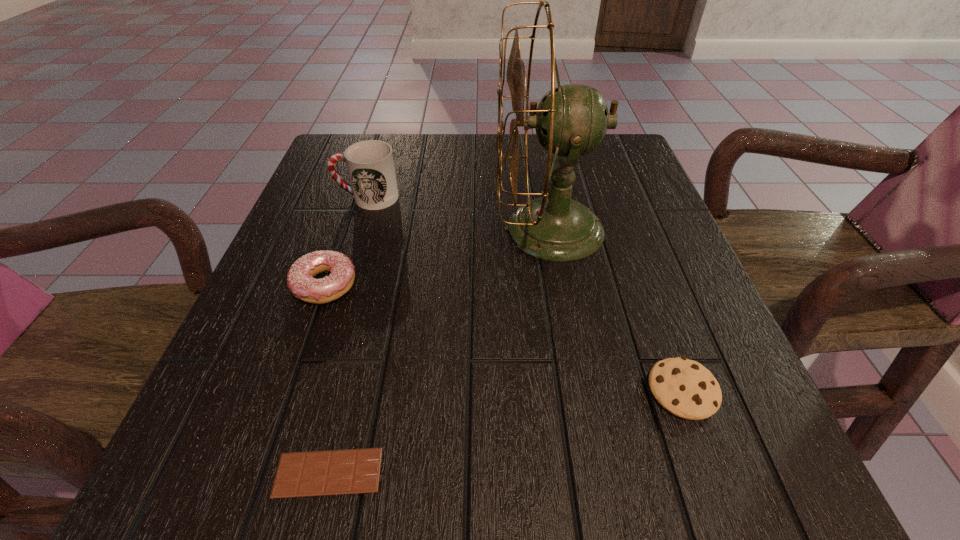
The image size is (960, 540). Identify the location of free space between the fourth shortest object and the second shortest object. (525, 294).

At what (x,y) coordinates should I click in order to perform the action: click on free space between the second tallest object and the fourth tallest object. Please return your answer as a coordinate pair (x, y). The image size is (960, 540). Looking at the image, I should click on (525, 294).

The height and width of the screenshot is (540, 960). Find the location of `vacant region between the cookie and the tallest object`. vacant region between the cookie and the tallest object is located at coordinates (616, 309).

This screenshot has width=960, height=540. Identify the location of vacant area that lies between the cup and the nearest object. (348, 335).

Locate an element on the screen. vacant area between the cup and the fourth tallest object is located at coordinates (525, 294).

The height and width of the screenshot is (540, 960). Find the location of `vacant space in between the doughnut and the fourth shortest object`. vacant space in between the doughnut and the fourth shortest object is located at coordinates (346, 241).

At what (x,y) coordinates should I click in order to perform the action: click on vacant area that lies between the shortest object and the cup. Please return your answer as a coordinate pair (x, y). The width and height of the screenshot is (960, 540). Looking at the image, I should click on pos(348,335).

In order to click on empty space between the second nearest object and the doughnut in this screenshot , I will do `click(503, 338)`.

Locate which object is the fourth closest to the chocolate bar. Please provide its 2D coordinates. Your answer should be formatted as a tuple, i.e. [(x, y)], where the tuple contains the x and y coordinates of a point satisfying the conditions above.

[(370, 164)]

Where is `the third closest object to the shortest object`? This screenshot has width=960, height=540. the third closest object to the shortest object is located at coordinates click(685, 388).